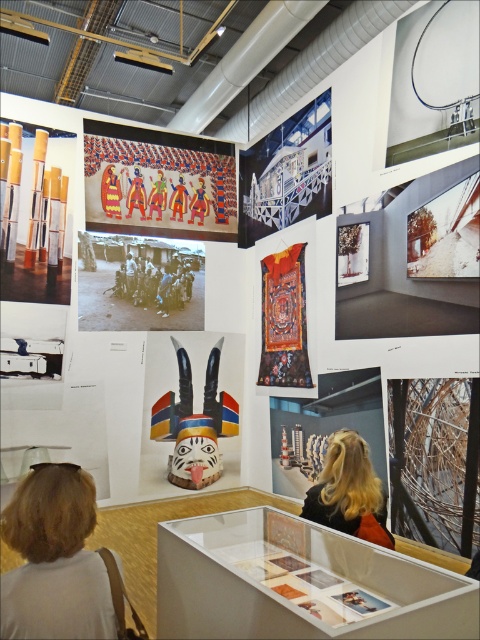
Is vivid painted figures at upper center taller than wooden painted mask at center?

No, vivid painted figures at upper center is not taller than wooden painted mask at center.

Who is more forward, [101,125] or [180,346]?

Point [101,125] is in front.

Describe the element at coordinates (158, 182) in the screenshot. I see `vivid painted figures at upper center` at that location.

The height and width of the screenshot is (640, 480). In order to click on vivid painted figures at upper center in this screenshot , I will do `click(158, 182)`.

Can you confirm if blonde hair at lower left is taller than vivid painted figures at upper center?

No, blonde hair at lower left is not taller than vivid painted figures at upper center.

Who is higher up, blonde hair at lower left or vivid painted figures at upper center?

vivid painted figures at upper center is above.

This screenshot has height=640, width=480. I want to click on blonde hair at lower left, so click(x=55, y=560).

Can you confirm if wooden painted mask at center is positioned below black and white photograph of people at center?

Yes.

Between point (205, 429) and point (197, 256), which one is positioned in front?

Positioned in front is point (205, 429).

Where is `wooden painted mask at center`? wooden painted mask at center is located at coordinates (194, 422).

Locate an element on the screen. This screenshot has width=480, height=640. wooden painted mask at center is located at coordinates (194, 422).